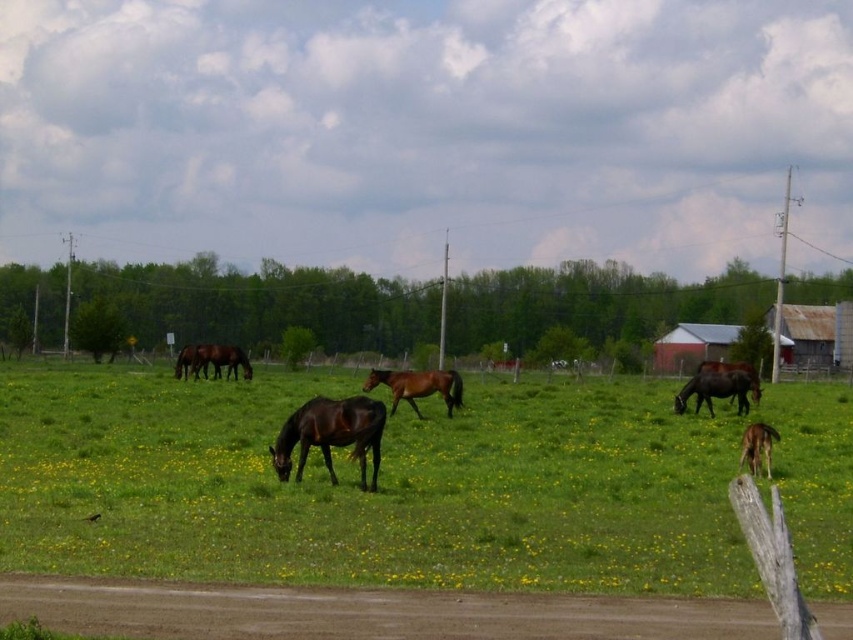
Who is positioned more to the right, glossy brown horse at center or brown glossy horse at left?

glossy brown horse at center is more to the right.

Does glossy brown horse at center have a lesser width compared to brown glossy horse at left?

Incorrect, glossy brown horse at center's width is not less than brown glossy horse at left's.

Is point (229, 371) closer to viewer compared to point (190, 356)?

No.

You are a GUI agent. You are given a task and a screenshot of the screen. Output one action in this format:
    pyautogui.click(x=<x>, y=<y>)
    Task: Click on the glossy brown horse at center
    
    Given the screenshot: What is the action you would take?
    pyautogui.click(x=219, y=360)

Does shiny brown horse at center appear on the left side of glossy brown horse at center?

Incorrect, shiny brown horse at center is not on the left side of glossy brown horse at center.

Is point (331, 420) positioned before point (196, 369)?

Yes, it is.

You are a GUI agent. You are given a task and a screenshot of the screen. Output one action in this format:
    pyautogui.click(x=<x>, y=<y>)
    Task: Click on the shiny brown horse at center
    The image size is (853, 640).
    Given the screenshot: What is the action you would take?
    pyautogui.click(x=331, y=435)

Locate an element on the screen. shiny brown horse at center is located at coordinates (331, 435).

Which is behind, point (236, 358) or point (770, 465)?

The point (236, 358) is behind.

In order to click on glossy brown horse at center in this screenshot , I will do `click(219, 360)`.

At what (x,y) coordinates should I click in order to perform the action: click on glossy brown horse at center. Please return your answer as a coordinate pair (x, y). Looking at the image, I should click on (219, 360).